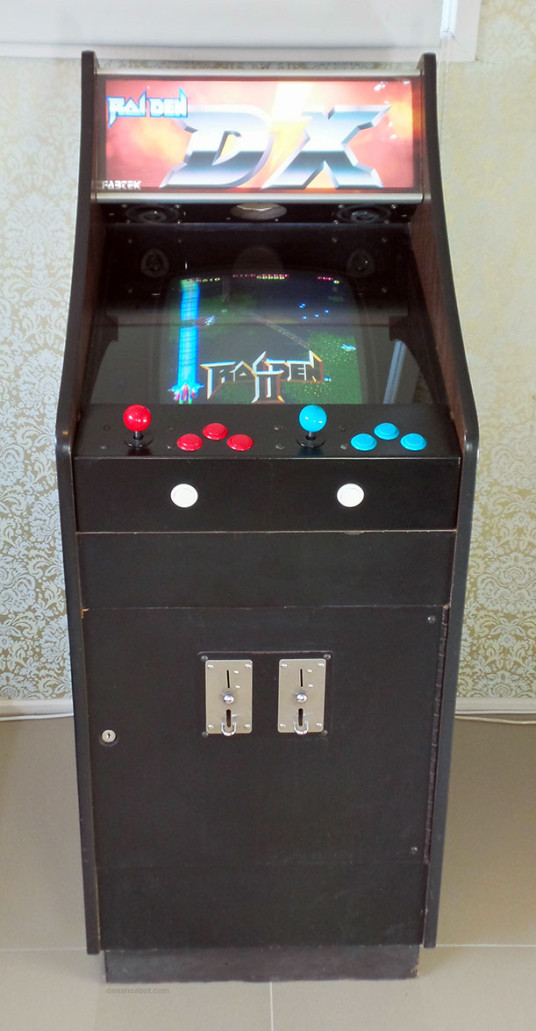
You are a GUI agent. You are given a task and a screenshot of the screen. Output one action in this format:
    pyautogui.click(x=<x>, y=<y>)
    Task: Click on the empty space next to arcade machine bottom
    
    Given the screenshot: What is the action you would take?
    pyautogui.click(x=443, y=961)